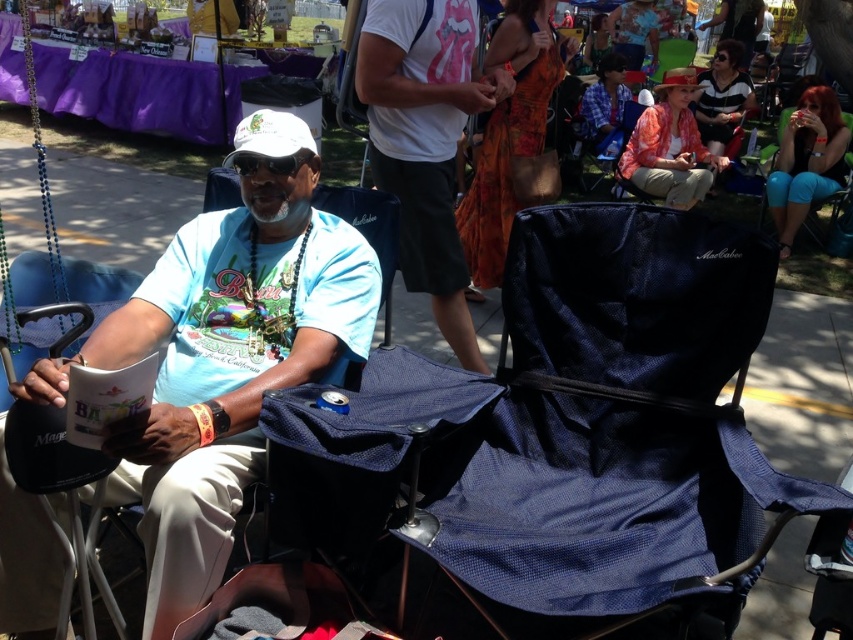
You are standing in the festival area and want to reach a specific point marked at coordinates point (434, 205). You have a 2.5 meter long pole. Can you safely use the pole to reach that point without moving closer?

The distance of point (434, 205) from viewer is 2.42 meters, so yes, the pole is longer than the distance, allowing you to safely reach the point without moving closer.

You are a fashion designer observing the teal denim shorts at right and the striped fabric shirt at upper right in the scene. Which clothing item is narrower in width?

The teal denim shorts at right has a lesser width compared to the striped fabric shirt at upper right, so the teal denim shorts at right is narrower in width.

Please look at the man in the blue folding chair. Which part of his clothing is located at the coordinate point (805, 161)?

The teal denim shorts at right is located at the coordinate point (805, 161).